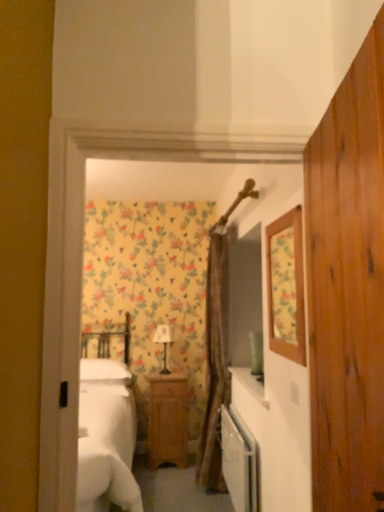
Question: Would you consider matte white lamp at center to be distant from brown textured curtain at center?

Choices:
 (A) yes
 (B) no

Answer: (B)

Question: Is matte white lamp at center turned away from brown textured curtain at center?

Choices:
 (A) no
 (B) yes

Answer: (A)

Question: Does matte white lamp at center have a greater width compared to brown textured curtain at center?

Choices:
 (A) no
 (B) yes

Answer: (A)

Question: Does matte white lamp at center contain brown textured curtain at center?

Choices:
 (A) yes
 (B) no

Answer: (B)

Question: From the image's perspective, is matte white lamp at center on top of brown textured curtain at center?

Choices:
 (A) no
 (B) yes

Answer: (A)

Question: In terms of width, does floral wallpaper mirror at upper right look wider or thinner when compared to brown textured curtain at center?

Choices:
 (A) thin
 (B) wide

Answer: (A)

Question: Considering the positions of floral wallpaper mirror at upper right and brown textured curtain at center in the image, is floral wallpaper mirror at upper right bigger or smaller than brown textured curtain at center?

Choices:
 (A) small
 (B) big

Answer: (A)

Question: Considering the positions of point (301, 345) and point (213, 328), is point (301, 345) closer or farther from the camera than point (213, 328)?

Choices:
 (A) farther
 (B) closer

Answer: (B)

Question: From a real-world perspective, is floral wallpaper mirror at upper right positioned above or below brown textured curtain at center?

Choices:
 (A) below
 (B) above

Answer: (B)

Question: Based on their sizes in the image, would you say white glossy dishwasher at center is bigger or smaller than wooden dresser at center?

Choices:
 (A) big
 (B) small

Answer: (A)

Question: From their relative heights in the image, would you say white glossy dishwasher at center is taller or shorter than wooden dresser at center?

Choices:
 (A) short
 (B) tall

Answer: (A)

Question: Looking at their shapes, would you say white glossy dishwasher at center is wider or thinner than wooden dresser at center?

Choices:
 (A) wide
 (B) thin

Answer: (A)

Question: In the image, is white glossy dishwasher at center positioned in front of or behind wooden dresser at center?

Choices:
 (A) front
 (B) behind

Answer: (B)

Question: Choose the correct answer: Is floral wallpaper mirror at upper right inside wooden nightstand at center or outside it?

Choices:
 (A) outside
 (B) inside

Answer: (A)

Question: Looking at the image, does floral wallpaper mirror at upper right seem bigger or smaller compared to wooden nightstand at center?

Choices:
 (A) small
 (B) big

Answer: (A)